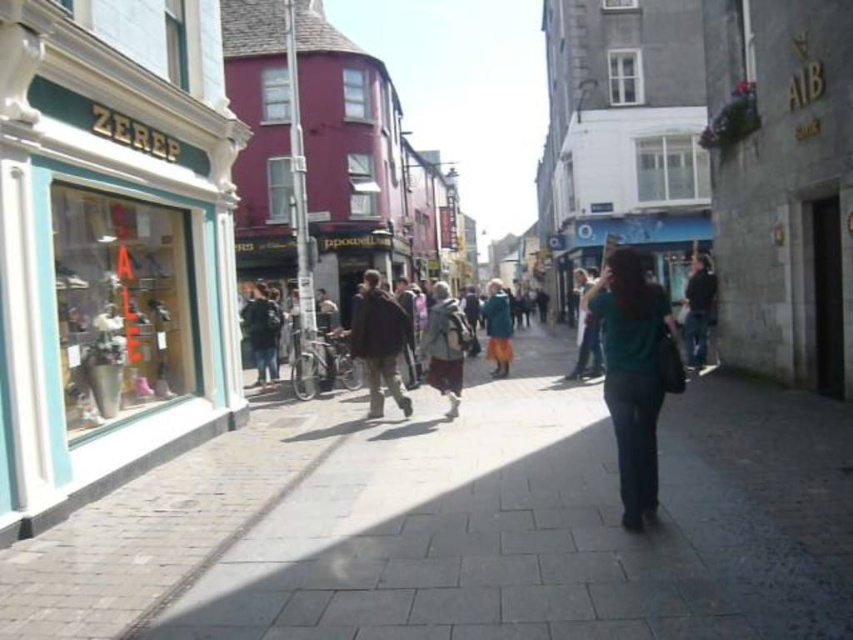
Is point (578, 449) positioned after point (634, 285)?

Yes, it is.

Can you confirm if brick pavement at center is positioned to the left of teal fabric shirt at center?

Correct, you'll find brick pavement at center to the left of teal fabric shirt at center.

Does point (672, 563) come closer to viewer compared to point (602, 396)?

Yes, point (672, 563) is in front of point (602, 396).

Find the location of `brick pavement at center`. brick pavement at center is located at coordinates (463, 524).

Image resolution: width=853 pixels, height=640 pixels. Describe the element at coordinates (111, 248) in the screenshot. I see `matte teal storefront at left` at that location.

Can you confirm if matte teal storefront at left is positioned to the right of teal fabric shirt at center?

In fact, matte teal storefront at left is to the left of teal fabric shirt at center.

Who is more distant from viewer, (x=204, y=177) or (x=631, y=326)?

Point (x=204, y=177)

Locate an element on the screen. The width and height of the screenshot is (853, 640). matte teal storefront at left is located at coordinates [x=111, y=248].

Between brick pavement at center and matte teal storefront at left, which one has less height?

With less height is brick pavement at center.

Who is higher up, brick pavement at center or matte teal storefront at left?

matte teal storefront at left is higher up.

At what (x,y) coordinates should I click in order to perform the action: click on brick pavement at center. Please return your answer as a coordinate pair (x, y). The height and width of the screenshot is (640, 853). Looking at the image, I should click on (463, 524).